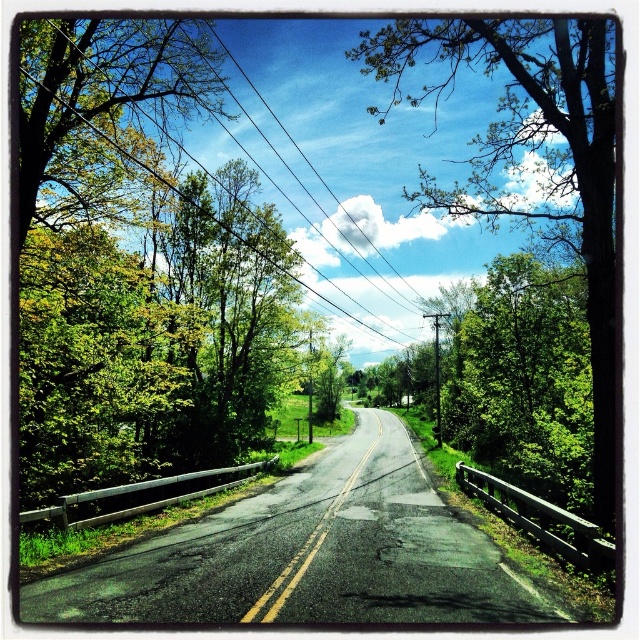
You are standing at the starting point of the road and want to take a photo of the green leafy tree at center. Which direction should you face to capture it in your camera?

The green leafy tree at center is located at point coordinates of (531, 157). Since you are at the starting point, facing the direction of the road which curves gently to the right, you should face towards the center of the road to capture the green leafy tree at center in your photo.

You are driving a car and want to know if the green leafy tree at center is closer to you than the black wire at upper center. Based on the scene, can you determine this?

Yes, the green leafy tree at center is in front of the black wire at upper center, which means it is closer to you.